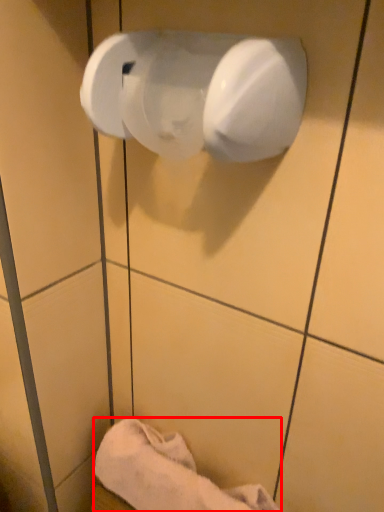
Question: From the image's perspective, what is the correct spatial positioning of towel (annotated by the red box) in reference to toilet paper?

Choices:
 (A) above
 (B) below

Answer: (B)